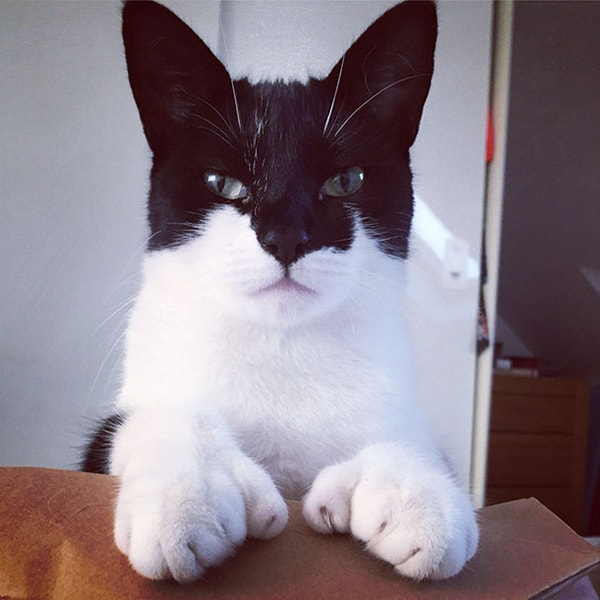
Identify the location of back wall. (40, 221).